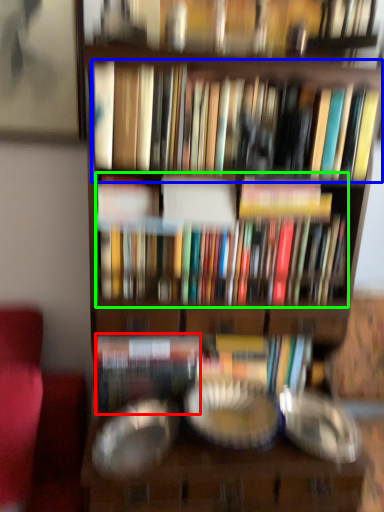
Question: Based on their relative distances, which object is nearer to paperback book (highlighted by a red box)? Choose from book (highlighted by a blue box) and book (highlighted by a green box).

Choices:
 (A) book
 (B) book

Answer: (B)